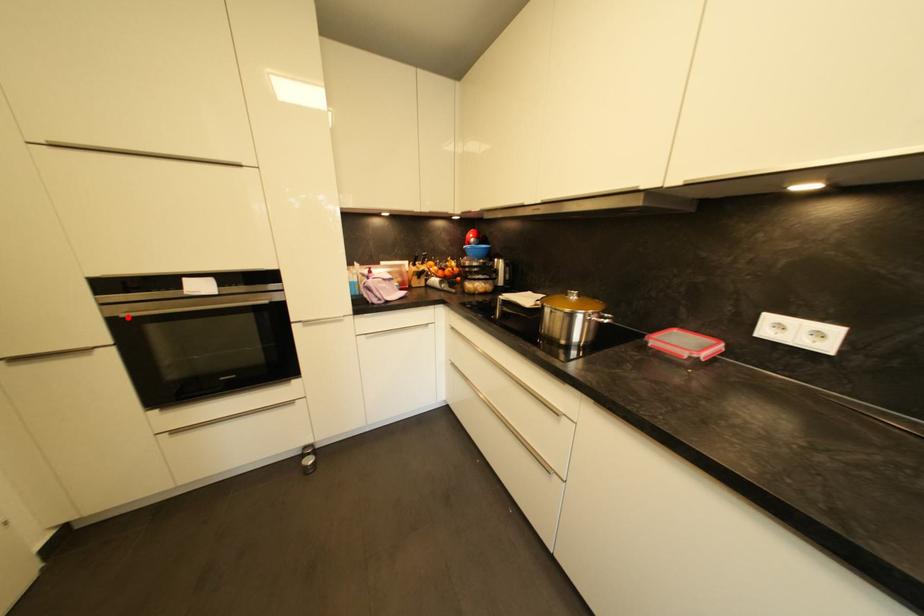
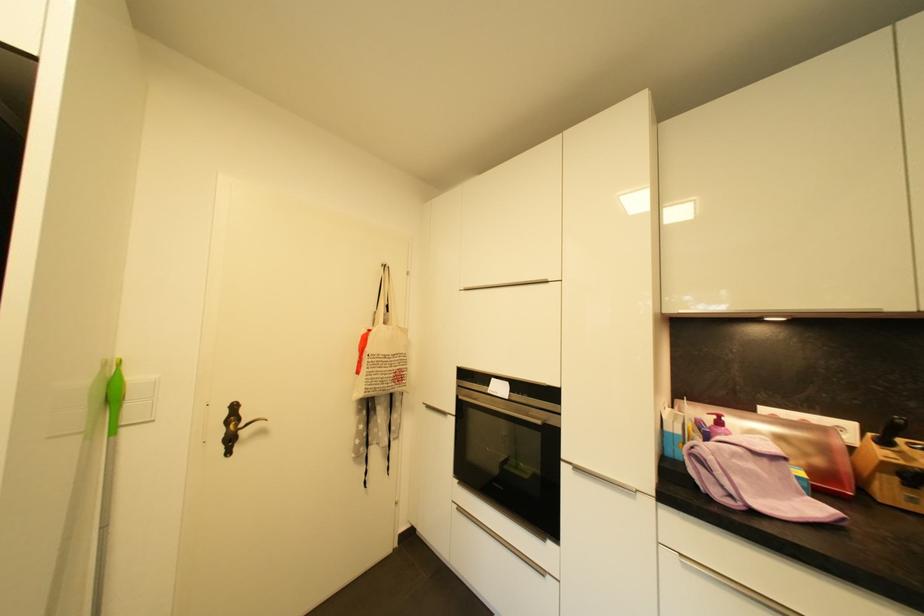
Locate, in the second image, the point that corresponds to the highlighted location in the first image.

(466, 399)